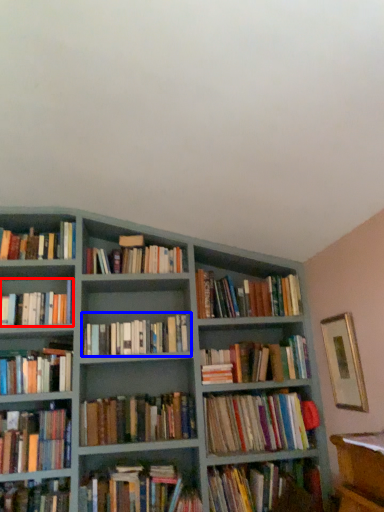
Question: Which of the following is the farthest to the observer, book (highlighted by a red box) or book (highlighted by a blue box)?

Choices:
 (A) book
 (B) book

Answer: (B)